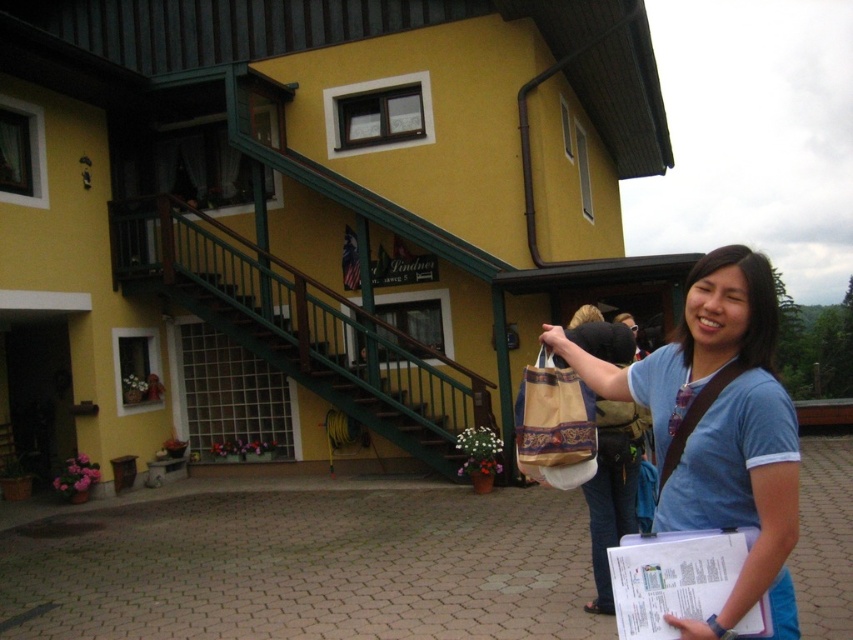
You are standing at the entrance of the Lindner hotel and want to take a photo of the point at coordinates point (770, 384). If your camera has a maximum focus range of 7 feet, will it be able to focus on that point?

The point (770, 384) is 7.22 feet from the camera, which exceeds the maximum focus range of 7 feet. Therefore, the camera will not be able to focus on that point.

You are standing in front of the Lindner guesthouse and see the matte blue shirt at center and the brown woven tote bag at center. Which item is nearer to you?

The matte blue shirt at center is closer to the viewer than the brown woven tote bag at center.

Consider the image. You are a photographer standing in front of the Lindner guesthouse. You notice a matte blue shirt at center and a brown woven tote bag at center. Which object is wider?

The matte blue shirt at center is wider than the brown woven tote bag at center according to the description.